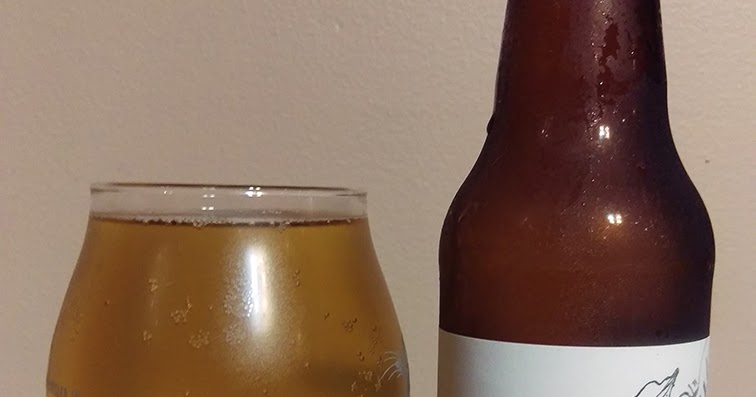
Locate an element on the screen. bottle is located at coordinates (575, 171).